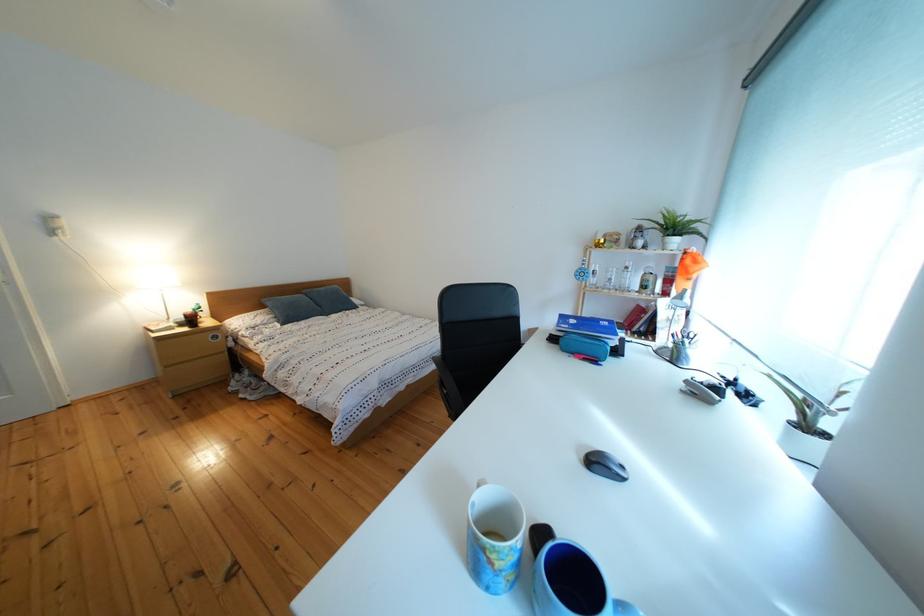
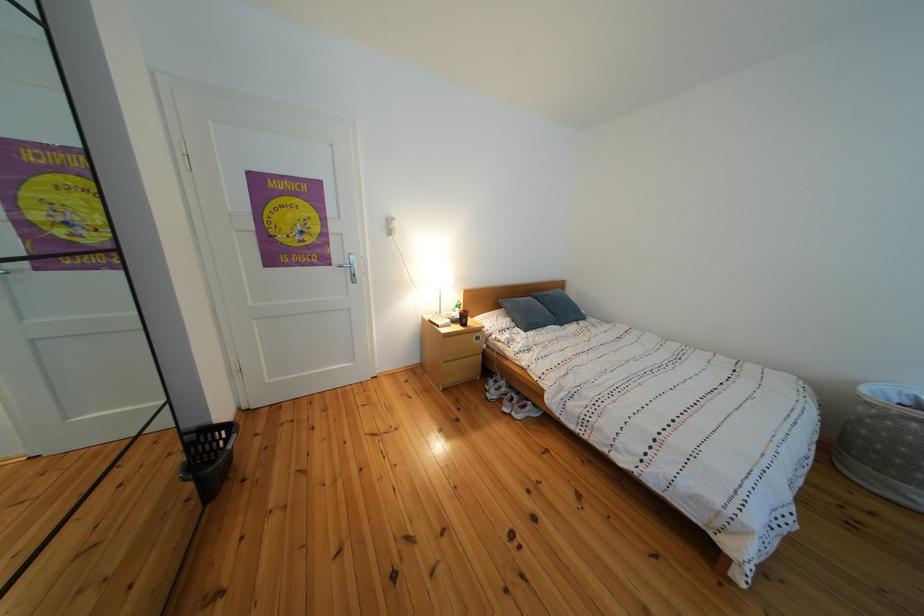
Where in the second image is the point corresponding to the point at 274,394 from the first image?

(540, 414)